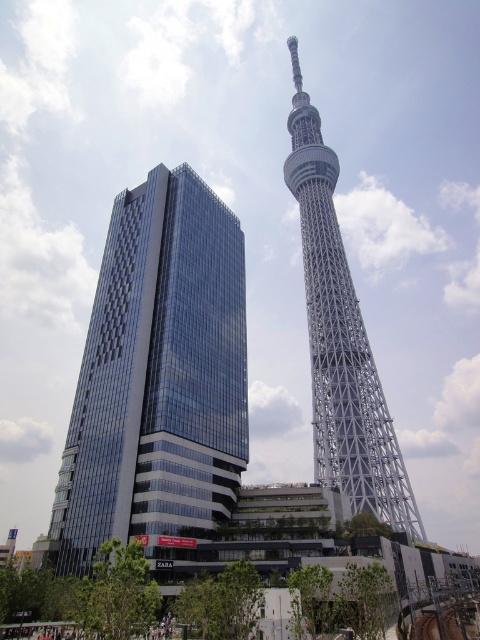
You are an architect evaluating the urban skyline. Given the scene, which structure is shorter between the glassy modern building at center and the white lattice tower at center?

The glassy modern building at center is shorter than the white lattice tower at center according to the description.

You are standing at the point marked by the coordinates point (x=340, y=340) in the image. What object are you facing?

The point (x=340, y=340) indicates the white lattice tower at center, so you are facing the white lattice tower at center.